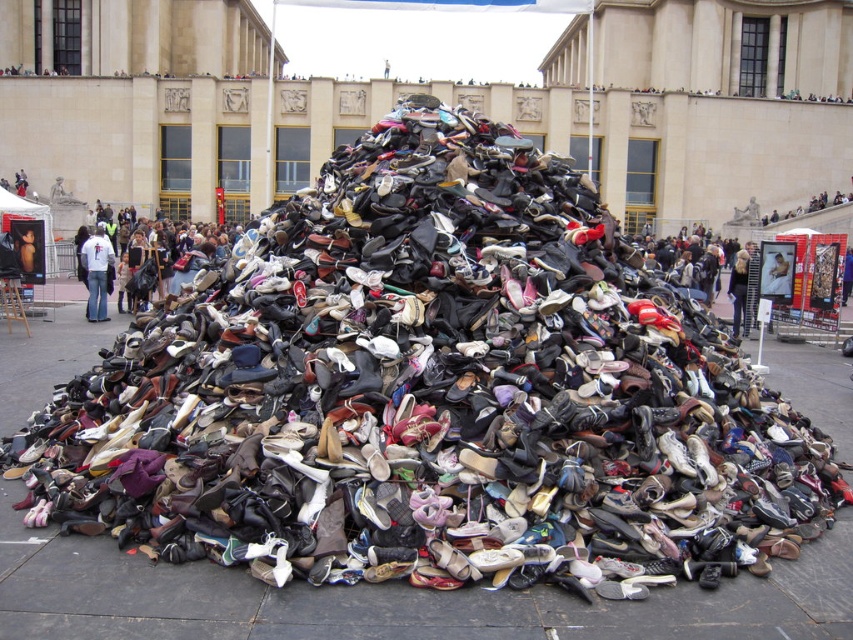
You are a person standing at the base of the grand building. You want to reach the smooth skin face at center located in the distance. The path is clear, but you have a strict time limit of 10 seconds. Can you make it in time?

The distance between you and the smooth skin face at center is 96.17 feet. To cover this distance in 10 seconds, you would need to run at an average speed of approximately 9.6 feet per second, which is faster than the typical human sprinting speed of around 20 feet per second. Therefore, it is possible to reach the smooth skin face at center within the time limit if you sprint at maximum speed.

You are packing a suitcase and have limited space. You need to choose between the denim jacket at center and the white cotton shirt at center to take with you. Which item should you choose to save more space?

The denim jacket at center is thinner than the white cotton shirt at center, so choosing the denim jacket at center will save more space in the suitcase.

You are standing in front of a grand building and see a smooth skin face at center and light blue jeans at center. Which one is nearer to you?

The smooth skin face at center is closer to the viewer than the light blue jeans at center.